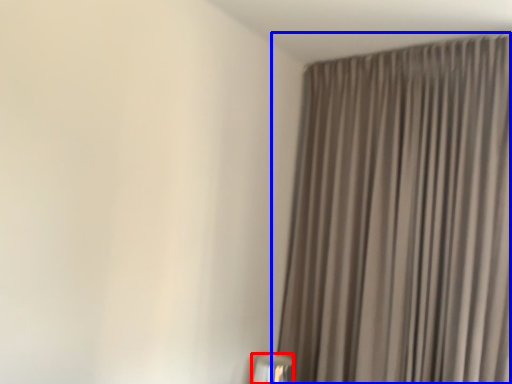
Question: Which of the following is the farthest to the observer, table lamp (highlighted by a red box) or curtain (highlighted by a blue box)?

Choices:
 (A) table lamp
 (B) curtain

Answer: (A)